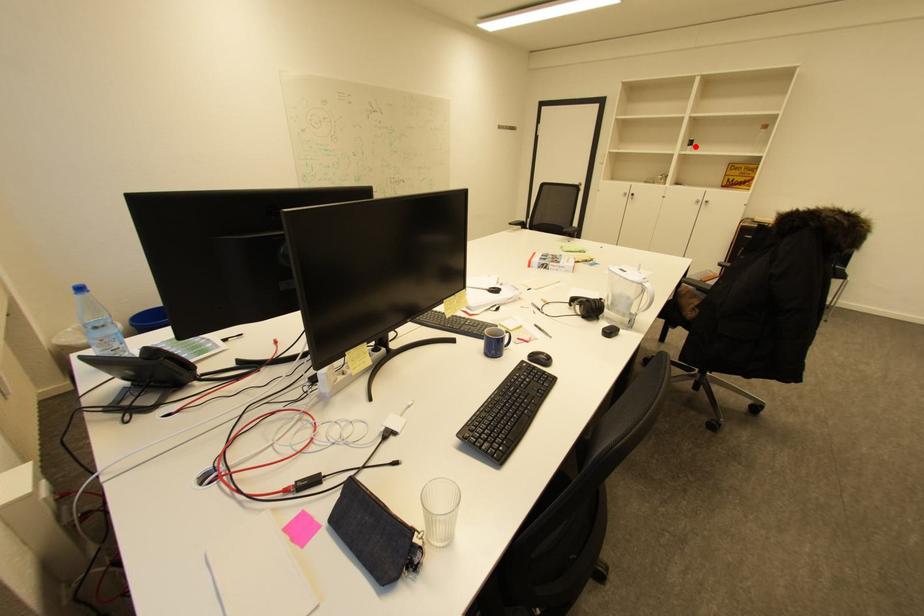
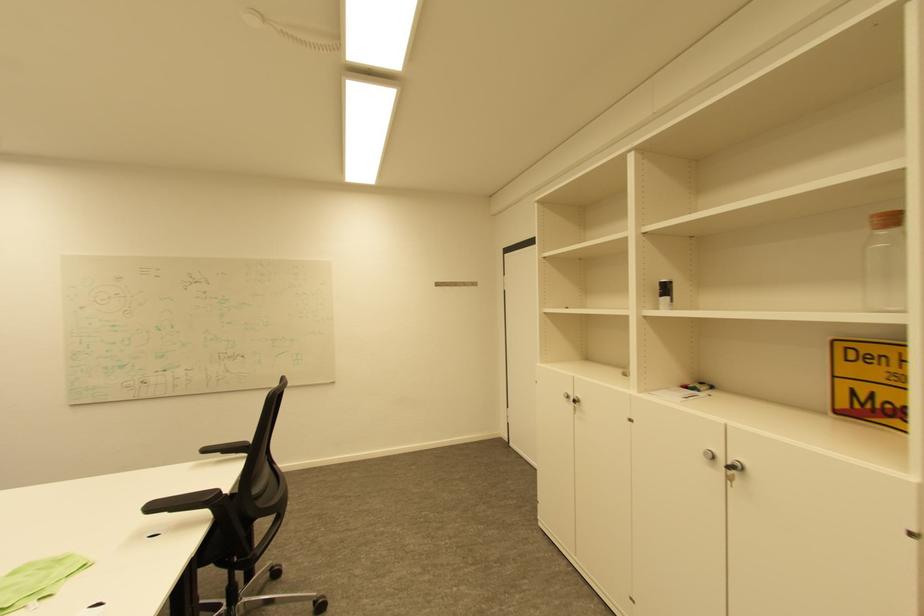
Find the pixel in the second image that matches the highlighted location in the first image.

(667, 296)